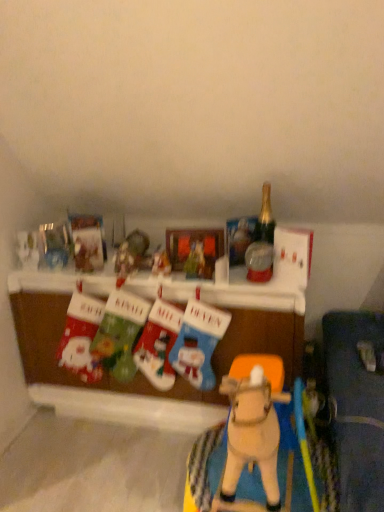
In order to face velvet green stocking at center, arranged as the second toy when viewed from the left, should I rotate leftwards or rightwards?

You should rotate left by 10.071 degrees.

This screenshot has width=384, height=512. What do you see at coordinates (119, 334) in the screenshot?
I see `velvet green stocking at center, arranged as the second toy when viewed from the left` at bounding box center [119, 334].

What do you see at coordinates (146, 325) in the screenshot?
I see `fabric christmas stockings at center` at bounding box center [146, 325].

Describe the element at coordinates (265, 218) in the screenshot. I see `gold glass bottle at upper right` at that location.

What is the approximate width of matte plastic ornament at center, arranged as the 4th toy when viewed from the left?

3.17 inches.

This screenshot has height=512, width=384. What are the coordinates of `matte plastic picture frame at center` in the screenshot? It's located at (194, 251).

What do you see at coordinates (198, 343) in the screenshot? Image resolution: width=384 pixels, height=512 pixels. I see `knitted wool stocking at center, which ranks as the fifth toy in left-to-right order` at bounding box center [198, 343].

Find the location of a particular element. knitted wool stocking at center, which ranks as the fifth toy in left-to-right order is located at coordinates (198, 343).

Locate an element on the screen. velvet green stocking at center, arranged as the second toy when viewed from the left is located at coordinates (119, 334).

From the picture: Does wooden horse at center, the 6th toy from the left, appear on the left side of matte fabric stocking at lower left, the 6th toy from the right?

No, wooden horse at center, the 6th toy from the left, is not to the left of matte fabric stocking at lower left, the 6th toy from the right.

Is wooden horse at center, placed as the first toy when sorted from right to left, aimed at matte fabric stocking at lower left, the 1th toy when ordered from left to right?

No, wooden horse at center, placed as the first toy when sorted from right to left, is not oriented towards matte fabric stocking at lower left, the 1th toy when ordered from left to right.

From a real-world perspective, is wooden horse at center, the 6th toy from the left, located beneath matte fabric stocking at lower left, the 6th toy from the right?

Correct, in the physical world, wooden horse at center, the 6th toy from the left, is lower than matte fabric stocking at lower left, the 6th toy from the right.

Is wooden horse at center, placed as the first toy when sorted from right to left, outside of matte fabric stocking at lower left, the 6th toy from the right?

That's correct, wooden horse at center, placed as the first toy when sorted from right to left, is outside of matte fabric stocking at lower left, the 6th toy from the right.

Between point (169, 287) and point (257, 225), which one is positioned behind?

The point (169, 287) is farther.

From the picture: From the image's perspective, which is below, fabric christmas stockings at center or gold glass bottle at upper right?

fabric christmas stockings at center, from the image's perspective.

Considering the relative sizes of fabric christmas stockings at center and gold glass bottle at upper right in the image provided, is fabric christmas stockings at center shorter than gold glass bottle at upper right?

Incorrect, the height of fabric christmas stockings at center does not fall short of that of gold glass bottle at upper right.

Considering the relative positions of fabric christmas stockings at center and gold glass bottle at upper right in the image provided, is fabric christmas stockings at center to the left or to the right of gold glass bottle at upper right?

fabric christmas stockings at center is positioned on gold glass bottle at upper right's left side.

In the scene shown: Can you confirm if gold glass bottle at upper right is smaller than fabric christmas stockings at center?

Yes.

Is gold glass bottle at upper right oriented towards fabric christmas stockings at center?

No, gold glass bottle at upper right is not facing towards fabric christmas stockings at center.

Is gold glass bottle at upper right surrounding fabric christmas stockings at center?

No, fabric christmas stockings at center is not surrounded by gold glass bottle at upper right.

Considering the sizes of objects gold glass bottle at upper right and fabric christmas stockings at center in the image provided, who is thinner, gold glass bottle at upper right or fabric christmas stockings at center?

gold glass bottle at upper right is thinner.

In order to click on picture frame behind the matte plastic ornament at center, acting as the third toy starting from the right in this screenshot , I will do `click(194, 251)`.

In the scene shown: Is matte plastic ornament at center, arranged as the 4th toy when viewed from the left, with matte plastic picture frame at center?

They are not placed beside each other.

From the image's perspective, is velvet green stocking at center, arranged as the second toy when viewed from the left, above or below gold glass bottle at upper right?

Based on their image positions, velvet green stocking at center, arranged as the second toy when viewed from the left, is located beneath gold glass bottle at upper right.

What are the coordinates of `bottle above the velvet green stocking at center, arranged as the second toy when viewed from the left (from the image's perspective)` in the screenshot? It's located at (265, 218).

Considering the sizes of objects velvet green stocking at center, arranged as the second toy when viewed from the left, and gold glass bottle at upper right in the image provided, who is thinner, velvet green stocking at center, arranged as the second toy when viewed from the left, or gold glass bottle at upper right?

Thinner between the two is gold glass bottle at upper right.

How different are the orientations of velvet green stocking at center, the fifth toy from the right, and gold glass bottle at upper right in degrees?

The facing directions of velvet green stocking at center, the fifth toy from the right, and gold glass bottle at upper right are 1.84 degrees apart.

This screenshot has width=384, height=512. Find the location of `toy that is the 2nd one when counting backward from the wooden horse at center, the 6th toy from the left`. toy that is the 2nd one when counting backward from the wooden horse at center, the 6th toy from the left is located at coordinates (158, 344).

From the image's perspective, is wooden horse at center, placed as the first toy when sorted from right to left, located above or below velvet christmas stockings at center, which appears as the third toy when viewed from the left?

wooden horse at center, placed as the first toy when sorted from right to left, is below velvet christmas stockings at center, which appears as the third toy when viewed from the left.

Choose the correct answer: Is wooden horse at center, placed as the first toy when sorted from right to left, inside velvet christmas stockings at center, which appears as the third toy when viewed from the left, or outside it?

wooden horse at center, placed as the first toy when sorted from right to left, is not inside velvet christmas stockings at center, which appears as the third toy when viewed from the left, it's outside.

From the picture: Is wooden horse at center, placed as the first toy when sorted from right to left, shorter than velvet christmas stockings at center, which is the 4th toy in right-to-left order?

Yes, wooden horse at center, placed as the first toy when sorted from right to left, is shorter than velvet christmas stockings at center, which is the 4th toy in right-to-left order.

Consider the image. Is knitted wool stocking at center, marked as the 2th toy in a right-to-left arrangement, aimed at wooden horse at center, placed as the first toy when sorted from right to left?

No, knitted wool stocking at center, marked as the 2th toy in a right-to-left arrangement, does not turn towards wooden horse at center, placed as the first toy when sorted from right to left.

Considering the points (197, 384) and (253, 481), which point is in front, point (197, 384) or point (253, 481)?

Point (253, 481)

Does knitted wool stocking at center, marked as the 2th toy in a right-to-left arrangement, have a lesser width compared to wooden horse at center, placed as the first toy when sorted from right to left?

Yes, knitted wool stocking at center, marked as the 2th toy in a right-to-left arrangement, is thinner than wooden horse at center, placed as the first toy when sorted from right to left.

There is a wooden horse at center, the 6th toy from the left. Where is `the 1st toy above it (from a real-world perspective)`? The image size is (384, 512). the 1st toy above it (from a real-world perspective) is located at coordinates (81, 336).

Image resolution: width=384 pixels, height=512 pixels. Find the location of `bottle above the fabric christmas stockings at center (from the image's perspective)`. bottle above the fabric christmas stockings at center (from the image's perspective) is located at coordinates (265, 218).

Based on their spatial positions, is wooden horse at center, placed as the first toy when sorted from right to left, or velvet green stocking at center, the fifth toy from the right, further from matte plastic picture frame at center?

Among the two, wooden horse at center, placed as the first toy when sorted from right to left, is located further to matte plastic picture frame at center.

Estimate the real-world distances between objects in this image. Which object is further from wooden horse at center, placed as the first toy when sorted from right to left, knitted wool stocking at center, which ranks as the fifth toy in left-to-right order, or gold glass bottle at upper right?

Result: Among the two, gold glass bottle at upper right is located further to wooden horse at center, placed as the first toy when sorted from right to left.

Based on their spatial positions, is matte plastic picture frame at center or matte plastic ornament at center, arranged as the 4th toy when viewed from the left, closer to wooden horse at center, placed as the first toy when sorted from right to left?

The object closer to wooden horse at center, placed as the first toy when sorted from right to left, is matte plastic picture frame at center.

Based on their spatial positions, is matte plastic picture frame at center or matte fabric stocking at lower left, the 6th toy from the right, closer to velvet green stocking at center, arranged as the second toy when viewed from the left?

Based on the image, matte fabric stocking at lower left, the 6th toy from the right, appears to be nearer to velvet green stocking at center, arranged as the second toy when viewed from the left.

Looking at the image, which one is located closer to gold glass bottle at upper right, knitted wool stocking at center, which ranks as the fifth toy in left-to-right order, or matte plastic picture frame at center?

The object closer to gold glass bottle at upper right is matte plastic picture frame at center.

When comparing their distances from gold glass bottle at upper right, does velvet green stocking at center, arranged as the second toy when viewed from the left, or fabric christmas stockings at center seem further?

The object further to gold glass bottle at upper right is velvet green stocking at center, arranged as the second toy when viewed from the left.

Considering their positions, is matte plastic ornament at center, arranged as the 4th toy when viewed from the left, positioned further to fabric christmas stockings at center than gold glass bottle at upper right?

gold glass bottle at upper right is further to fabric christmas stockings at center.

When comparing their distances from matte fabric stocking at lower left, the 1th toy when ordered from left to right, does fabric christmas stockings at center or matte plastic ornament at center, acting as the third toy starting from the right, seem closer?

Based on the image, fabric christmas stockings at center appears to be nearer to matte fabric stocking at lower left, the 1th toy when ordered from left to right.

Identify the location of table between matte fabric stocking at lower left, the 1th toy when ordered from left to right, and gold glass bottle at upper right from left to right. (146, 325).

I want to click on table located between matte fabric stocking at lower left, the 6th toy from the right, and knitted wool stocking at center, marked as the 2th toy in a right-to-left arrangement, in the left-right direction, so click(146, 325).

Identify the location of toy between velvet christmas stockings at center, which is the 4th toy in right-to-left order, and wooden horse at center, the 6th toy from the left, in the vertical direction. (198, 343).

The image size is (384, 512). What are the coordinates of `toy between matte plastic picture frame at center and velvet green stocking at center, arranged as the second toy when viewed from the left, in the up-down direction` in the screenshot? It's located at (161, 264).